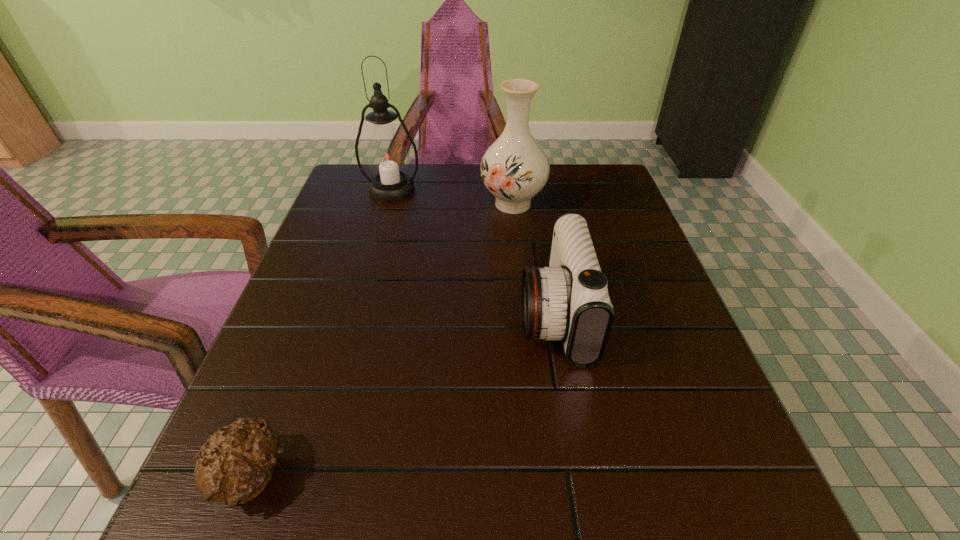
At what (x,y) coordinates should I click in order to perform the action: click on oil lamp. Please return your answer as a coordinate pair (x, y). Looking at the image, I should click on (386, 155).

Identify the location of vase. (515, 168).

Locate an element on the screen. This screenshot has height=540, width=960. the third farthest object is located at coordinates (569, 301).

This screenshot has width=960, height=540. I want to click on the second shortest object, so click(569, 301).

Identify the location of muffin. (233, 466).

Locate an element on the screen. the shortest object is located at coordinates (233, 466).

The height and width of the screenshot is (540, 960). I want to click on free space located 0.210m on the right of the oil lamp, so click(498, 189).

Locate an element on the screen. free space located 0.360m on the front of the vase is located at coordinates (526, 335).

I want to click on free space located on the surface of the third tallest object, so click(375, 315).

The image size is (960, 540). Identify the location of vacant space located on the surface of the third tallest object. (391, 315).